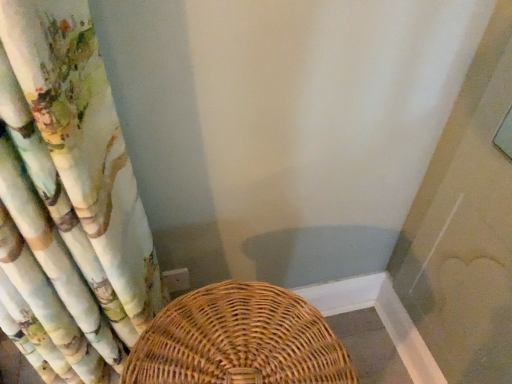
I want to click on blank space above woven brown basket at lower center (from a real-world perspective), so click(232, 336).